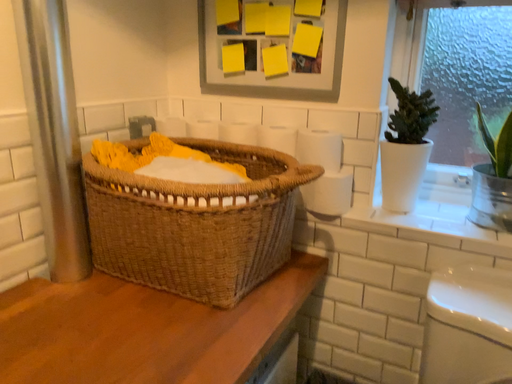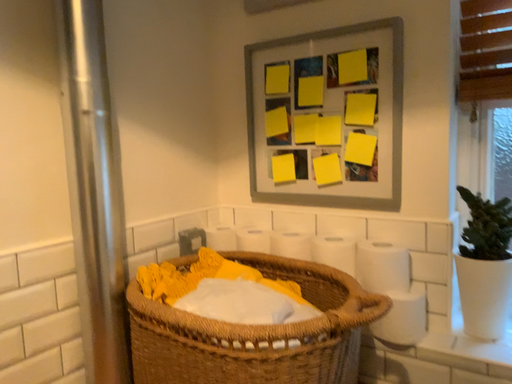
Question: Which way did the camera rotate in the video?

Choices:
 (A) rotated left
 (B) rotated right

Answer: (A)